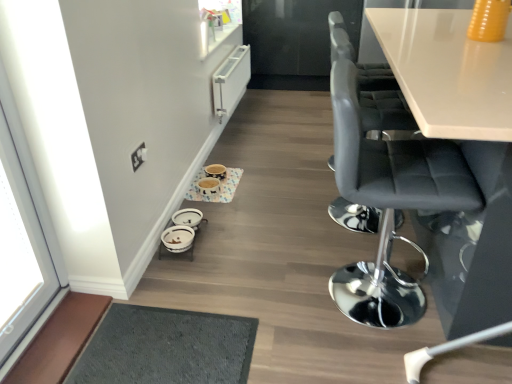
Find the location of a particular element. empty space that is to the right of matte ceramic bowls at center, the second round table in the front-to-back sequence is located at coordinates (269, 184).